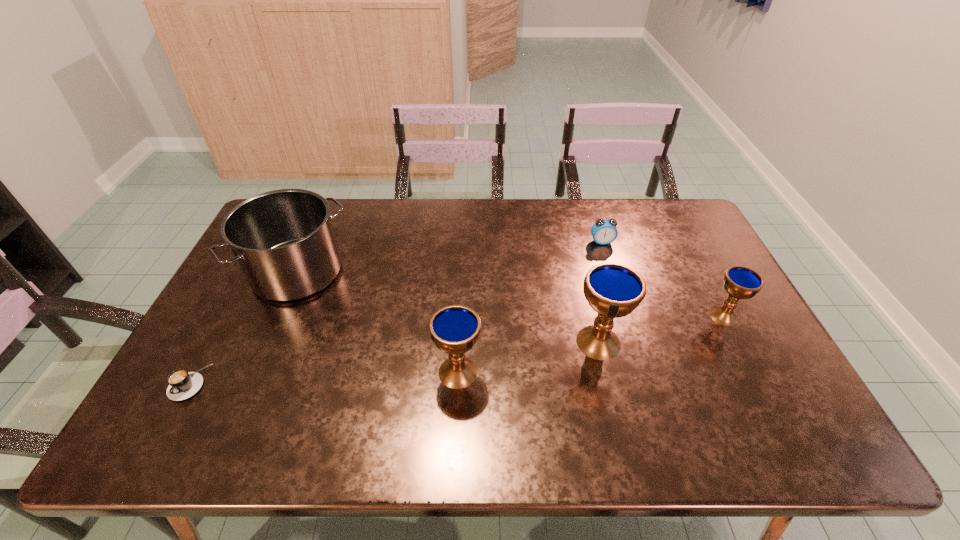
In order to click on vacant space at the far edge of the desktop in this screenshot , I will do `click(535, 212)`.

The image size is (960, 540). I want to click on free space at the near edge of the desktop, so click(642, 387).

In the image, there is a desktop. Where is `free region at the left edge`? The height and width of the screenshot is (540, 960). free region at the left edge is located at coordinates (244, 325).

In the image, there is a desktop. At what (x,y) coordinates should I click in order to perform the action: click on vacant space at the right edge. Please return your answer as a coordinate pair (x, y). This screenshot has height=540, width=960. Looking at the image, I should click on (760, 349).

At what (x,y) coordinates should I click in order to perform the action: click on free space that is in between the saucepan and the shortest chalice. Please return your answer as a coordinate pair (x, y). The height and width of the screenshot is (540, 960). Looking at the image, I should click on (511, 294).

This screenshot has width=960, height=540. In order to click on empty space between the shortest chalice and the alarm clock in this screenshot , I will do `click(662, 279)`.

This screenshot has width=960, height=540. Identify the location of vacant area that lies between the cappuccino and the tallest chalice. (394, 362).

Where is `free point between the fourth tallest object and the saucepan`? This screenshot has height=540, width=960. free point between the fourth tallest object and the saucepan is located at coordinates (511, 294).

Find the location of a particular element. This screenshot has height=540, width=960. free space between the second chalice from right to left and the shortest object is located at coordinates (394, 362).

Image resolution: width=960 pixels, height=540 pixels. I want to click on free space between the second chalice from right to left and the rightmost chalice, so click(661, 329).